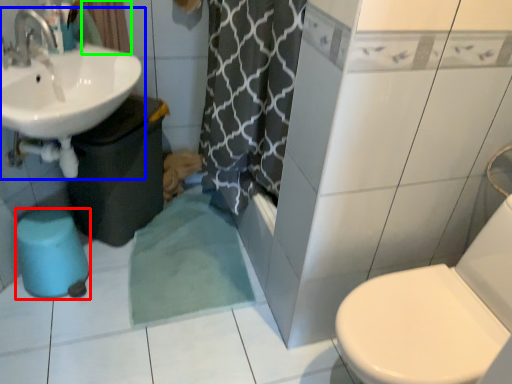
Question: Which object is positioned closest to bidet (highlighted by a red box)? Select from sink (highlighted by a blue box) and curtain (highlighted by a green box).

Choices:
 (A) sink
 (B) curtain

Answer: (A)